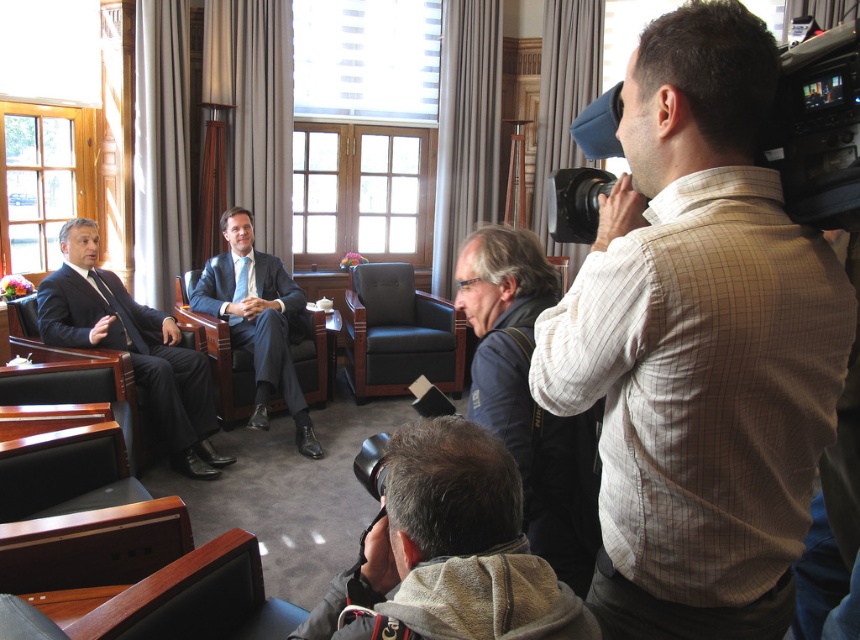
You are standing at point [169,400] in the image. You want to move to the other side of the room to join a colleague. The room is 5 meters wide. Can you walk straight ahead from your current position without crossing the path of the two people seated on the left side of the frame?

The two people seated on the left side of the frame are 3.66 meters apart. Since the room is 5 meters wide, there is enough space between them and the walls to walk straight ahead without crossing their path.

You are attending a formal event and need to sit down. There are two seats available. One is occupied by the matte black suit at left, and the other is the leather armchair at center. Which seat has a wider seat area?

The matte black suit at left has a wider seat area than the leather armchair at center according to the description.